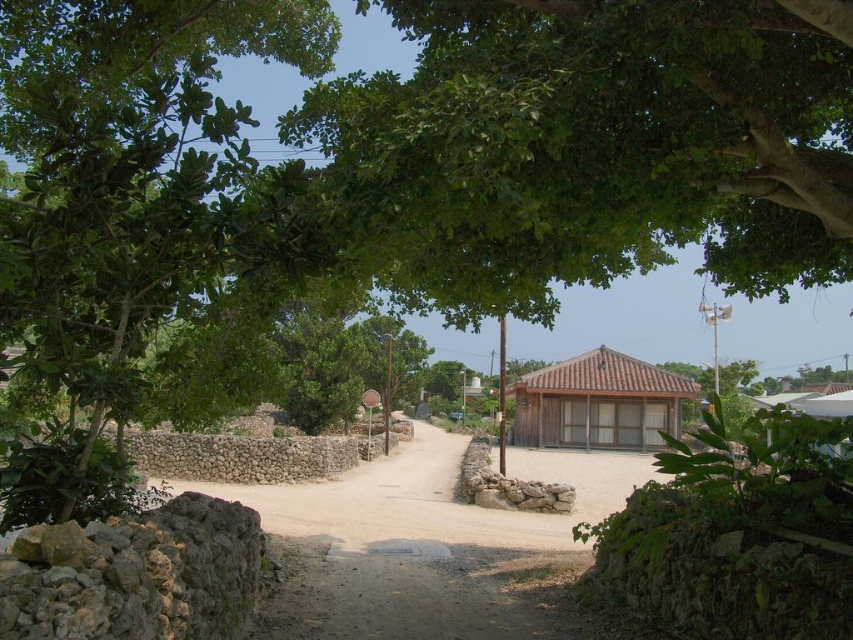
Question: Does green leafy tree at left lie behind brown wooden hut at center?

Choices:
 (A) no
 (B) yes

Answer: (A)

Question: Can you confirm if green leafy tree at left is smaller than brown wooden hut at center?

Choices:
 (A) no
 (B) yes

Answer: (B)

Question: Does green leafy tree at left have a larger size compared to brown wooden hut at center?

Choices:
 (A) no
 (B) yes

Answer: (A)

Question: Which of the following is the closest to the observer?

Choices:
 (A) green leafy tree at left
 (B) brown wooden hut at center

Answer: (A)

Question: Which of the following is the farthest from the observer?

Choices:
 (A) green leafy tree at left
 (B) brown wooden hut at center

Answer: (B)

Question: Which point is closer to the camera?

Choices:
 (A) (309, 60)
 (B) (581, 400)

Answer: (A)